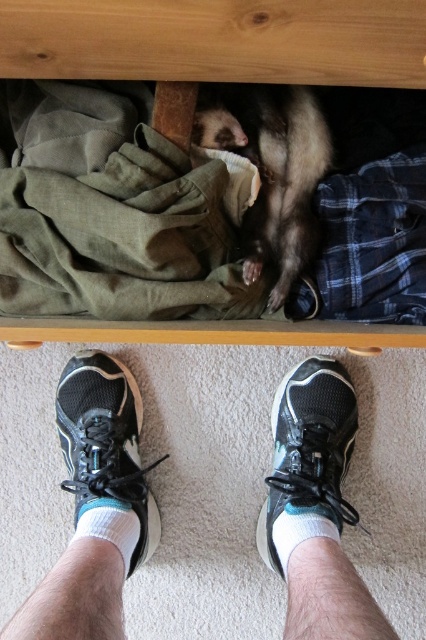
You are trying to decide which of the two black mesh sneakers at center and black mesh shoe at lower center would be better to wear for a hike. Considering their sizes, which one might provide more comfort for your feet?

The black mesh sneakers at center has a larger size compared to the black mesh shoe at lower center, so it might provide more comfort for your feet during a hike.

You are a delivery robot trying to reach the fuzzy brown ferret at center. There is a black mesh shoe at center in your path. Can you navigate around the shoe to reach the ferret?

The fuzzy brown ferret at center is closer to the viewer than the black mesh shoe at center, so the robot can navigate around the shoe to reach the ferret since the ferret is in front of the shoe.